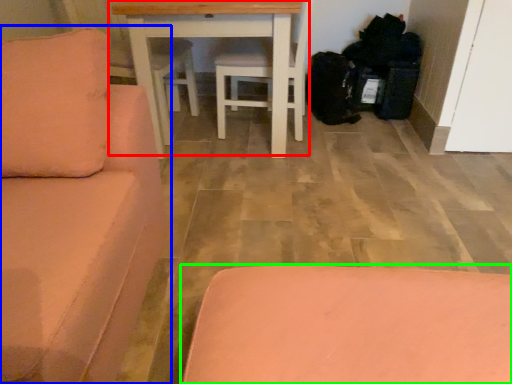
Question: Based on their relative distances, which object is nearer to table (highlighted by a red box)? Choose from studio couch (highlighted by a blue box) and furniture (highlighted by a green box).

Choices:
 (A) studio couch
 (B) furniture

Answer: (A)